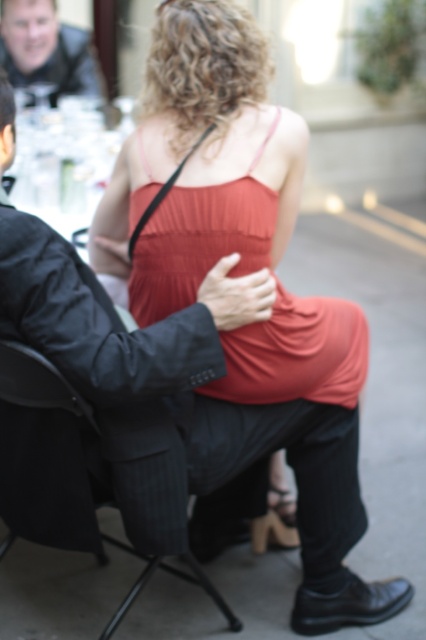
How much distance is there between white glossy table at upper left and matte black jacket at upper left?

white glossy table at upper left is 17.27 inches away from matte black jacket at upper left.

Can you confirm if white glossy table at upper left is positioned above matte black jacket at upper left?

No, white glossy table at upper left is not above matte black jacket at upper left.

Is point (63, 212) behind point (46, 20)?

No.

This screenshot has width=426, height=640. I want to click on white glossy table at upper left, so click(x=66, y=160).

Measure the distance between point [135,211] and camera.

A distance of 1.72 meters exists between point [135,211] and camera.

Does matte red dress at center have a greater width compared to white glossy table at upper left?

Yes.

The width and height of the screenshot is (426, 640). In order to click on matte red dress at center in this screenshot , I will do `click(198, 241)`.

Can you confirm if white glossy table at upper left is taller than black fabric chair at lower center?

Correct, white glossy table at upper left is much taller as black fabric chair at lower center.

Is white glossy table at upper left to the left of black fabric chair at lower center from the viewer's perspective?

Correct, you'll find white glossy table at upper left to the left of black fabric chair at lower center.

Is point (14, 202) farther from viewer compared to point (16, 374)?

Yes, point (14, 202) is behind point (16, 374).

At what (x,y) coordinates should I click in order to perform the action: click on white glossy table at upper left. Please return your answer as a coordinate pair (x, y). This screenshot has width=426, height=640. Looking at the image, I should click on (66, 160).